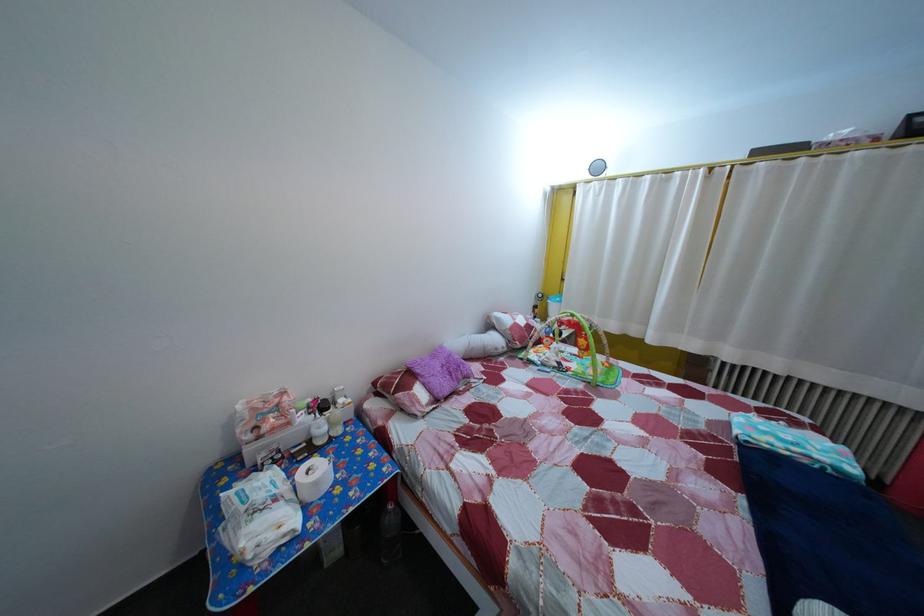
Where is `white window curtain`? This screenshot has width=924, height=616. white window curtain is located at coordinates (758, 257).